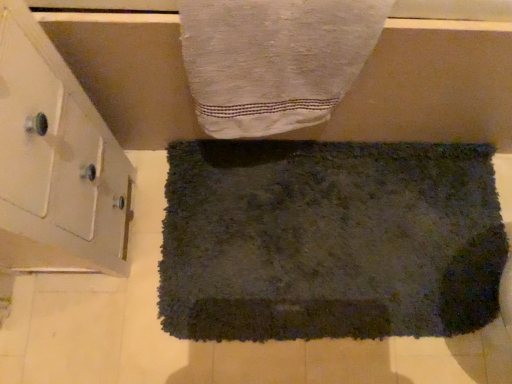
Where is `vacant space underneath dark gray shaggy rug at center, arranged as the second towel when viewed from the front (from a real-world perspective)`? The height and width of the screenshot is (384, 512). vacant space underneath dark gray shaggy rug at center, arranged as the second towel when viewed from the front (from a real-world perspective) is located at coordinates (327, 238).